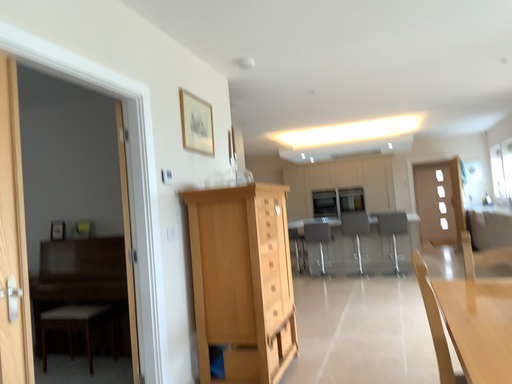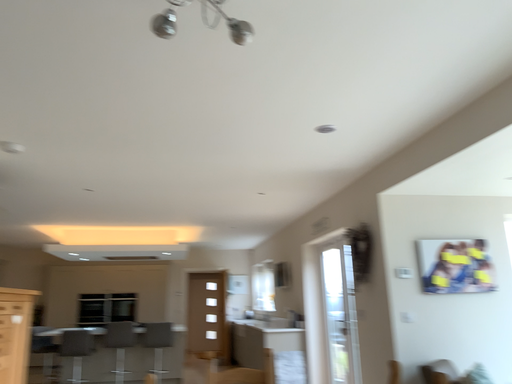
Question: How did the camera likely rotate when shooting the video?

Choices:
 (A) rotated left
 (B) rotated right

Answer: (B)